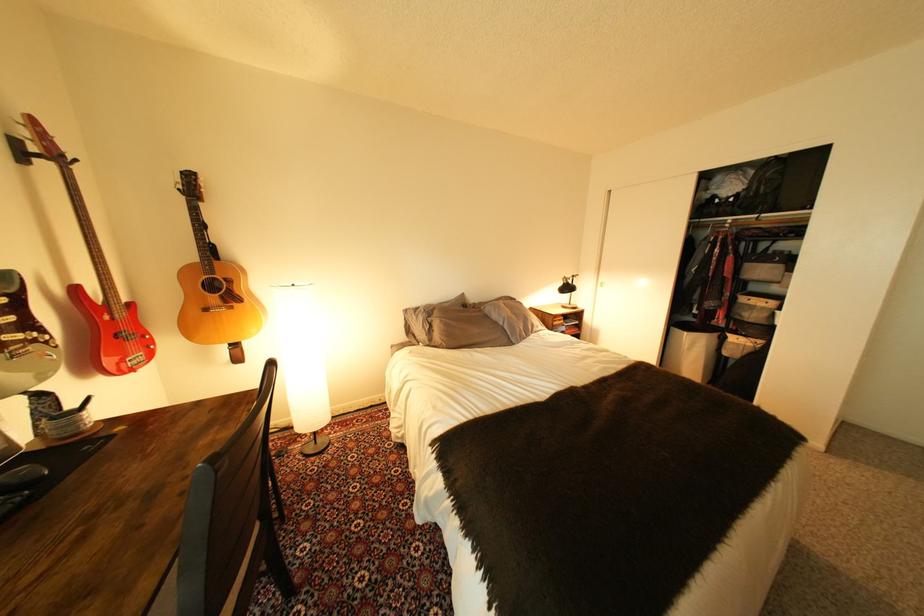
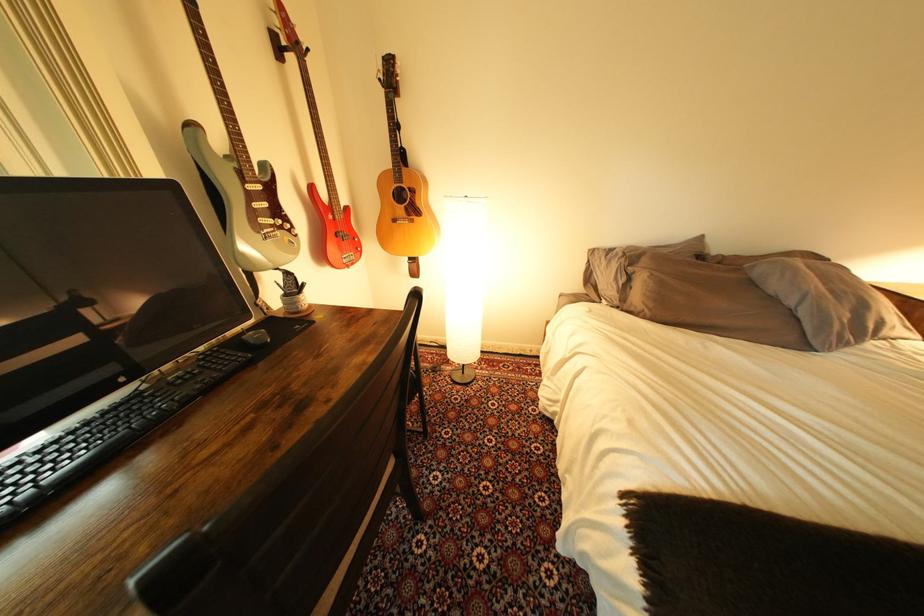
In the second image, find the point that corresponds to [26,350] in the first image.

(278, 233)